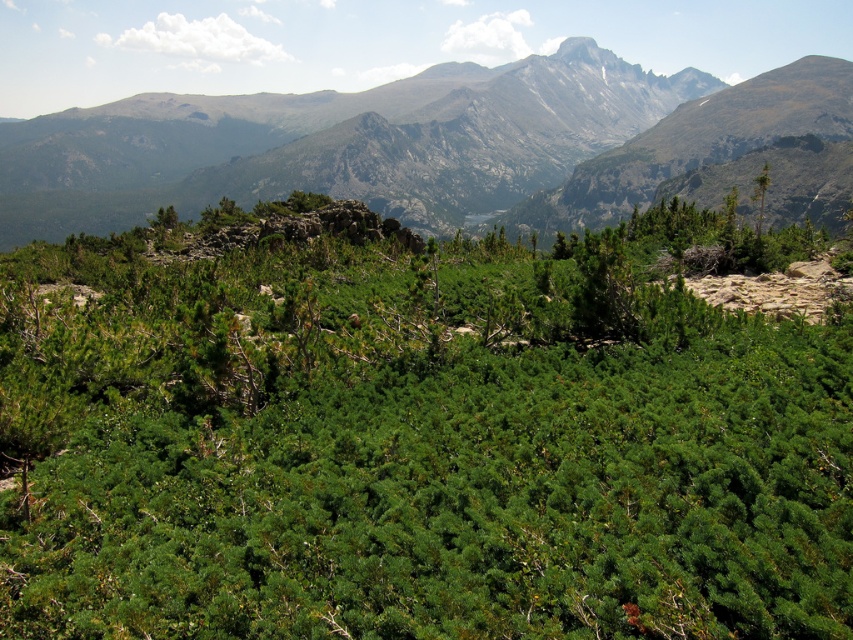
Question: Does green needle-like plants at center have a greater width compared to rocky gray mountain range at upper center?

Choices:
 (A) no
 (B) yes

Answer: (A)

Question: Does rocky gray mountain range at upper center appear on the right side of green needle-like at upper right?

Choices:
 (A) yes
 (B) no

Answer: (B)

Question: Which object is the closest to the rocky gray mountain range at upper center?

Choices:
 (A) green needle-like plants at center
 (B) green needle-like at upper right

Answer: (A)

Question: Which object appears farthest from the camera in this image?

Choices:
 (A) green needle-like at upper right
 (B) green needle-like plants at center

Answer: (A)

Question: Which of these objects is positioned closest to the rocky gray mountain range at upper center?

Choices:
 (A) green needle-like plants at center
 (B) green needle-like at upper right

Answer: (A)

Question: Can you confirm if green needle-like plants at center is thinner than rocky gray mountain range at upper center?

Choices:
 (A) yes
 (B) no

Answer: (A)